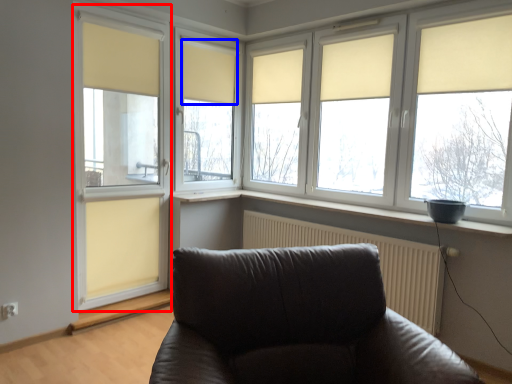
Question: Which object appears farthest to the camera in this image, glass door (highlighted by a red box) or curtain (highlighted by a blue box)?

Choices:
 (A) glass door
 (B) curtain

Answer: (B)